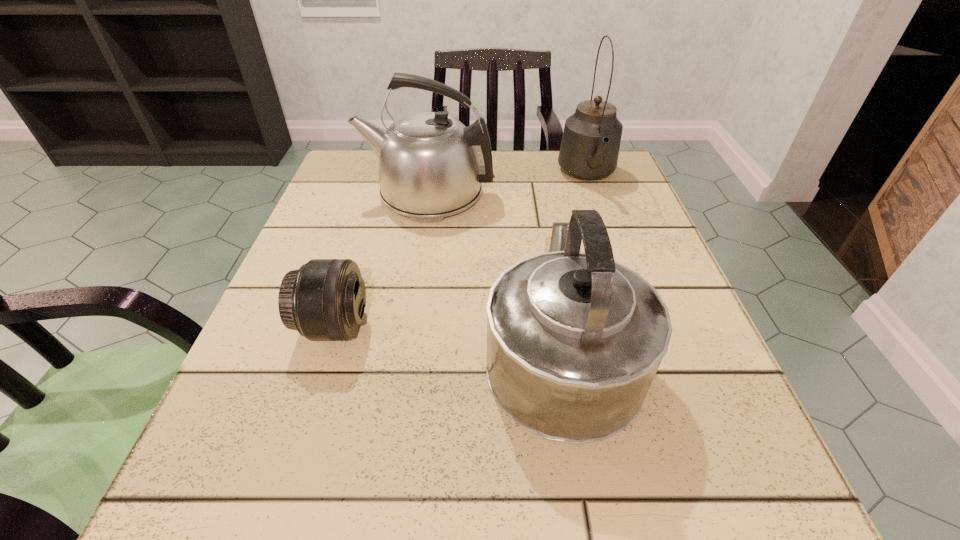
The image size is (960, 540). Find the location of `free space that satisfies the following two spatial constraints: 1. on the front-facing side of the telephoto lens; 2. with the spout at the front of the nearest kettle`. free space that satisfies the following two spatial constraints: 1. on the front-facing side of the telephoto lens; 2. with the spout at the front of the nearest kettle is located at coordinates (327, 349).

Image resolution: width=960 pixels, height=540 pixels. I want to click on free region that satisfies the following two spatial constraints: 1. on the front-facing side of the telephoto lens; 2. with the spout at the front of the nearest kettle, so click(x=327, y=349).

At what (x,y) coordinates should I click in order to perform the action: click on free region that satisfies the following two spatial constraints: 1. on the front-facing side of the shortest object; 2. with the spout at the front of the nearest kettle. Please return your answer as a coordinate pair (x, y). The width and height of the screenshot is (960, 540). Looking at the image, I should click on (327, 349).

Identify the location of free space that satisfies the following two spatial constraints: 1. on the front-facing side of the shortest object; 2. with the spout at the front of the nearest kettle. (327, 349).